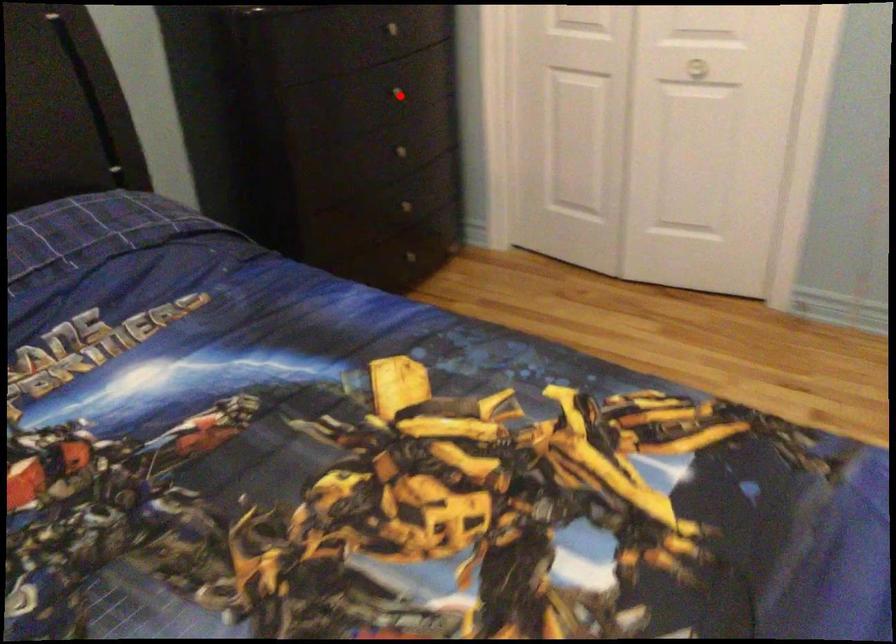
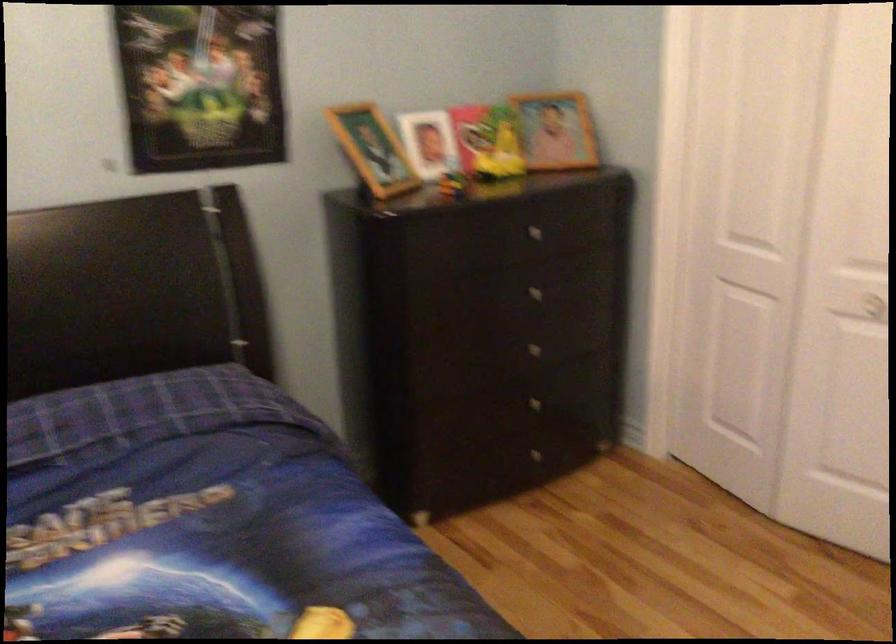
The point at the highlighted location is marked in the first image. Where is the corresponding point in the second image?

(538, 292)